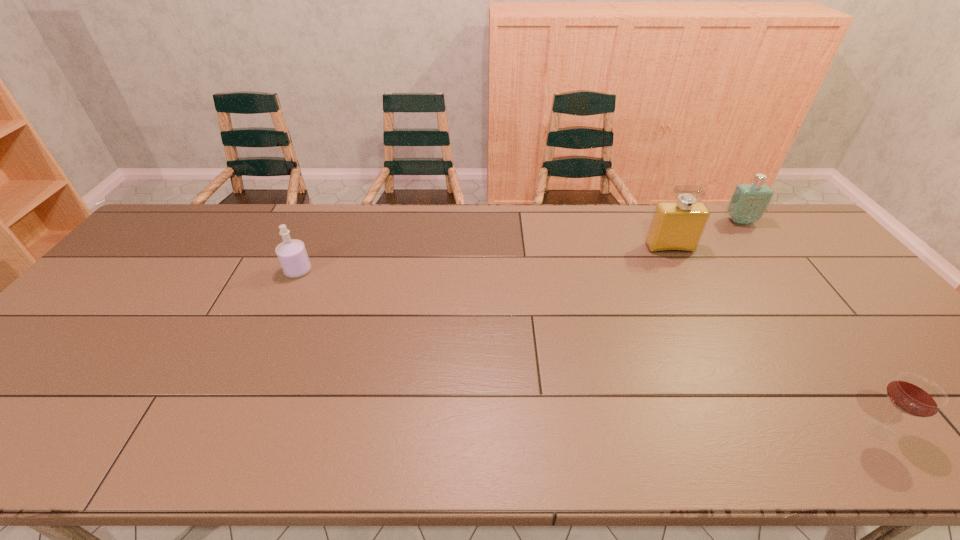
Identify which perfume is the nearest to the nearest object. Please provide its 2D coordinates. Your answer should be formatted as a tuple, i.e. [(x, y)], where the tuple contains the x and y coordinates of a point satisfying the conditions above.

[(677, 226)]

This screenshot has height=540, width=960. Identify the location of perfume identified as the second closest to the rightmost perfume. (292, 255).

This screenshot has height=540, width=960. Find the location of `free location that satisfies the following two spatial constraints: 1. on the front-facing side of the tallest object; 2. on the right side of the wineglass`. free location that satisfies the following two spatial constraints: 1. on the front-facing side of the tallest object; 2. on the right side of the wineglass is located at coordinates (762, 429).

The width and height of the screenshot is (960, 540). I want to click on vacant space that satisfies the following two spatial constraints: 1. on the front side of the nearest object; 2. on the right side of the third farthest object, so [x=225, y=429].

The image size is (960, 540). I want to click on free space in the image that satisfies the following two spatial constraints: 1. on the front-facing side of the wineglass; 2. on the left side of the second perfume from left to right, so click(762, 429).

Locate an element on the screen. The height and width of the screenshot is (540, 960). free space that satisfies the following two spatial constraints: 1. on the front-facing side of the third object from right to left; 2. on the right side of the wineglass is located at coordinates (762, 429).